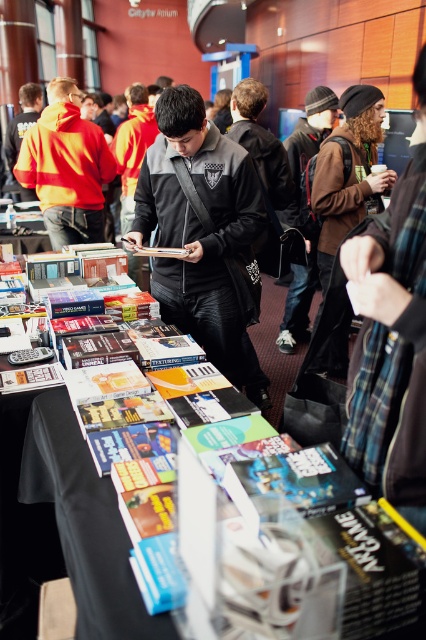
Can you confirm if black matte jacket at center is smaller than brown leather jacket at center?

→ Actually, black matte jacket at center might be larger than brown leather jacket at center.

Is point (154, 141) farther from viewer compared to point (313, 134)?

No.

Identify the location of black matte jacket at center. This screenshot has width=426, height=640. click(204, 234).

Is black matte jacket at center thinner than orange-yellow hoodie at left?

Correct, black matte jacket at center's width is less than orange-yellow hoodie at left's.

Measure the distance from black matte jacket at center to orange-yellow hoodie at left.

They are 5.38 feet apart.

Locate an element on the screen. black matte jacket at center is located at coordinates (204, 234).

How distant is orange-yellow hoodie at left from brown leather jacket at center?

They are 1.53 meters apart.

Which is more to the right, orange-yellow hoodie at left or brown leather jacket at center?

From the viewer's perspective, brown leather jacket at center appears more on the right side.

Find the location of a particular element. The width and height of the screenshot is (426, 640). orange-yellow hoodie at left is located at coordinates (66, 166).

Find the location of a particular element. This screenshot has height=640, width=426. orange-yellow hoodie at left is located at coordinates (66, 166).